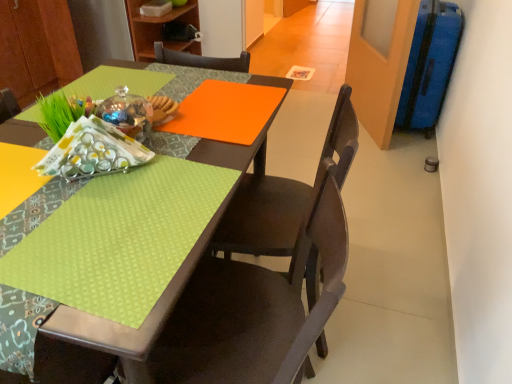
Question: Does matte brown chair at lower center, the second chair in the back-to-front sequence, have a greater height compared to wooden bookshelf at upper center?

Choices:
 (A) yes
 (B) no

Answer: (A)

Question: Does matte brown chair at lower center, acting as the 1th chair starting from the front, have a greater width compared to wooden bookshelf at upper center?

Choices:
 (A) yes
 (B) no

Answer: (B)

Question: Is matte brown chair at lower center, the second chair in the back-to-front sequence, turned away from wooden bookshelf at upper center?

Choices:
 (A) yes
 (B) no

Answer: (B)

Question: Is matte brown chair at lower center, acting as the 1th chair starting from the front, smaller than wooden bookshelf at upper center?

Choices:
 (A) yes
 (B) no

Answer: (B)

Question: From a real-world perspective, is matte brown chair at lower center, acting as the 1th chair starting from the front, on top of wooden bookshelf at upper center?

Choices:
 (A) yes
 (B) no

Answer: (B)

Question: Is matte brown chair at lower center, acting as the 1th chair starting from the front, in contact with wooden bookshelf at upper center?

Choices:
 (A) no
 (B) yes

Answer: (A)

Question: From the image's perspective, would you say matte dark wood chair at center, which ranks as the second chair in front-to-back order, is positioned over lime green fabric at lower left?

Choices:
 (A) yes
 (B) no

Answer: (B)

Question: Is matte dark wood chair at center, which ranks as the second chair in front-to-back order, thinner than lime green fabric at lower left?

Choices:
 (A) no
 (B) yes

Answer: (A)

Question: Is matte dark wood chair at center, arranged as the 1th chair when viewed from the back, wider than lime green fabric at lower left?

Choices:
 (A) yes
 (B) no

Answer: (A)

Question: Does matte dark wood chair at center, which ranks as the second chair in front-to-back order, have a lesser height compared to lime green fabric at lower left?

Choices:
 (A) no
 (B) yes

Answer: (A)

Question: Considering the relative positions of matte dark wood chair at center, arranged as the 1th chair when viewed from the back, and lime green fabric at lower left in the image provided, is matte dark wood chair at center, arranged as the 1th chair when viewed from the back, behind lime green fabric at lower left?

Choices:
 (A) no
 (B) yes

Answer: (B)

Question: Does matte dark wood chair at center, arranged as the 1th chair when viewed from the back, come in front of lime green fabric at lower left?

Choices:
 (A) yes
 (B) no

Answer: (B)

Question: Considering the relative positions of lime green fabric at lower left and matte dark wood chair at center, arranged as the 1th chair when viewed from the back, in the image provided, is lime green fabric at lower left to the right of matte dark wood chair at center, arranged as the 1th chair when viewed from the back, from the viewer's perspective?

Choices:
 (A) yes
 (B) no

Answer: (B)